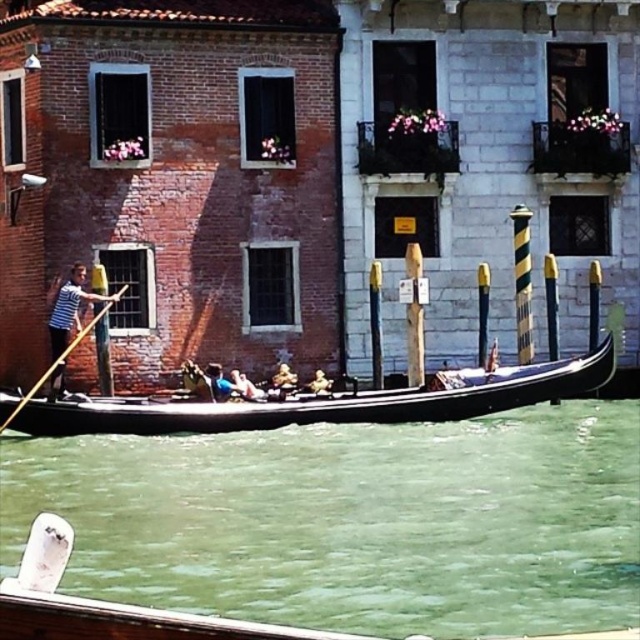
Question: Which of the following is the farthest from the observer?

Choices:
 (A) (326, 381)
 (B) (70, 321)
 (C) (518, 292)

Answer: (C)

Question: Can you confirm if smooth skin person at center is positioned to the left of smooth golden helmet at center?

Choices:
 (A) no
 (B) yes

Answer: (B)

Question: Where is green striped pole at center located in relation to golden textured statue at center in the image?

Choices:
 (A) below
 (B) above

Answer: (B)

Question: Considering the real-world distances, which object is closest to the smooth golden helmet at center?

Choices:
 (A) green striped pole at center
 (B) black polished wood gondola at center
 (C) green water at lower center
 (D) smooth skin person at center

Answer: (D)

Question: Can you confirm if striped cotton shirt at left is wider than golden textured statue at center?

Choices:
 (A) yes
 (B) no

Answer: (B)

Question: Which point appears farthest from the camera in this image?

Choices:
 (A) (216, 416)
 (B) (288, 384)
 (C) (312, 388)

Answer: (B)